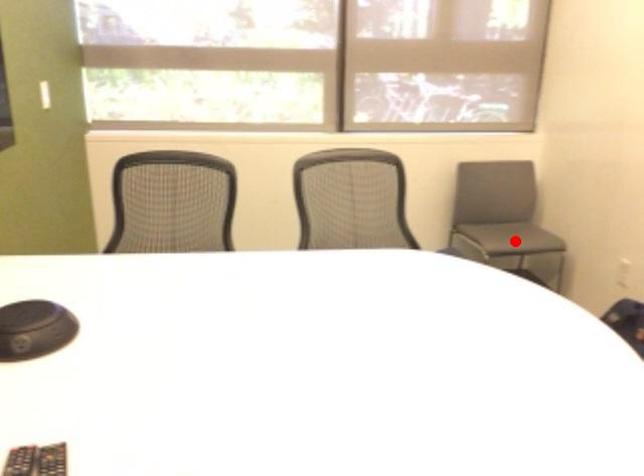
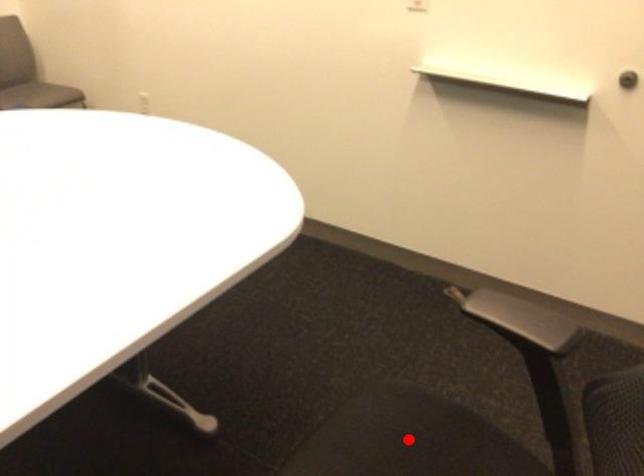
I am providing you with two images of the same scene from different viewpoints. A red point is marked on the first image and another point is marked on the second image. Do the highlighted points in image1 and image2 indicate the same real-world spot?

No